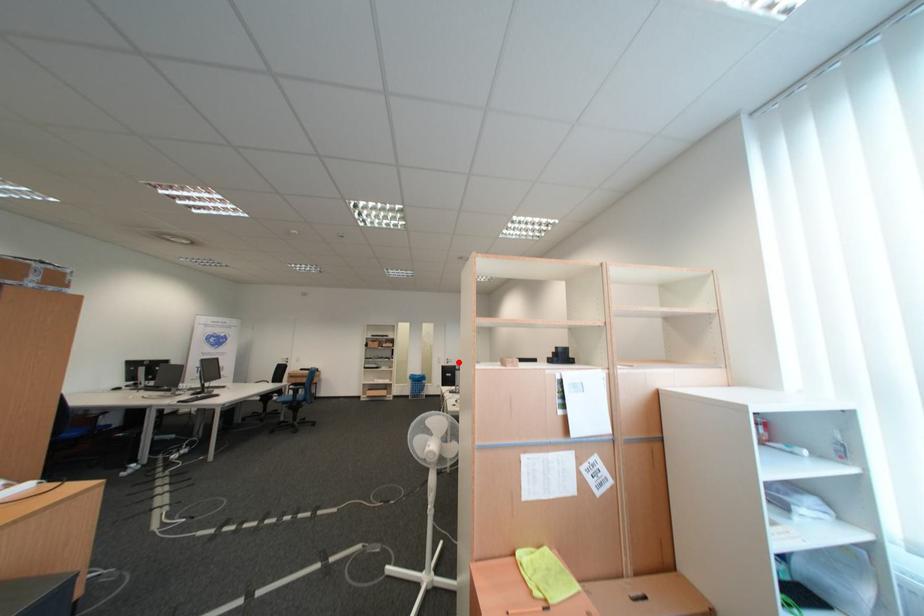
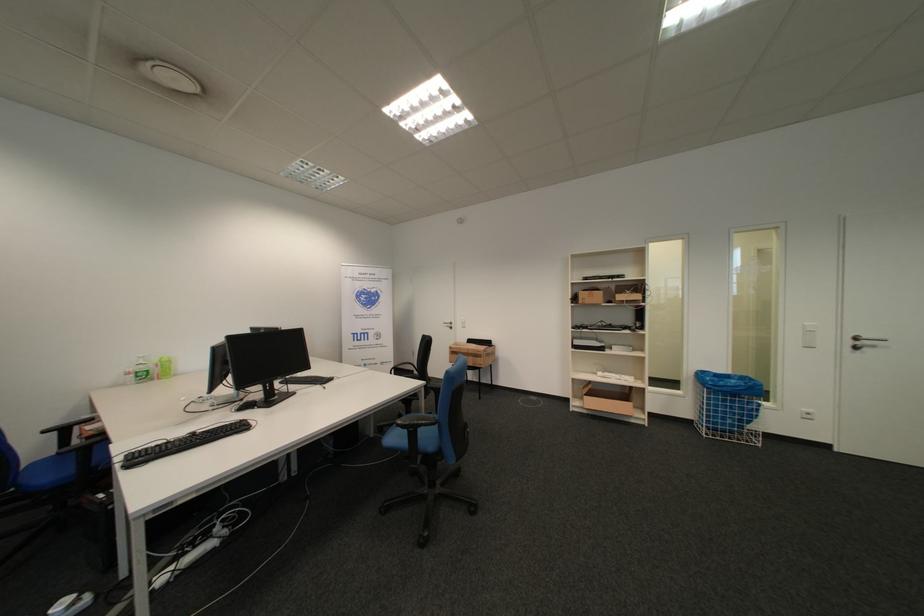
Where in the second image is the point corresponding to the highlighted location from the first image?

(862, 344)